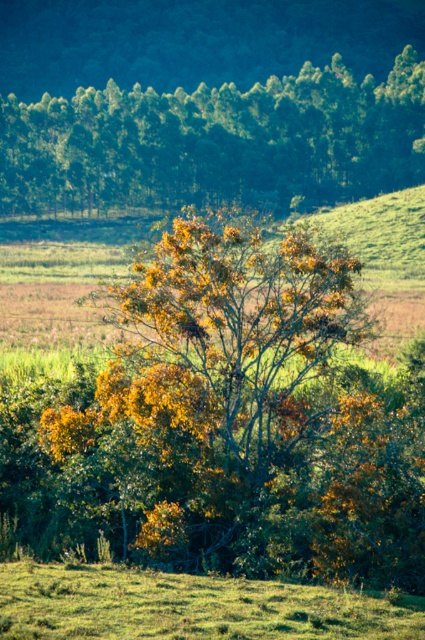
Does yellow-green leafy tree at upper center have a greater height compared to green grass at lower center?

Yes, yellow-green leafy tree at upper center is taller than green grass at lower center.

Does point (302, 99) come closer to viewer compared to point (291, 637)?

No, it is not.

Describe the element at coordinates (217, 141) in the screenshot. I see `yellow-green leafy tree at upper center` at that location.

I want to click on yellow-green leafy tree at upper center, so click(217, 141).